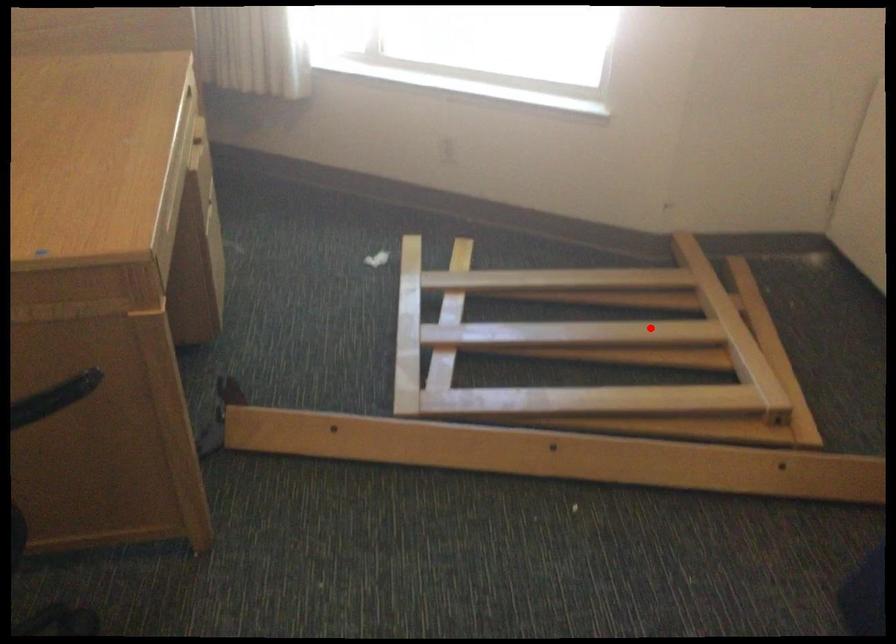
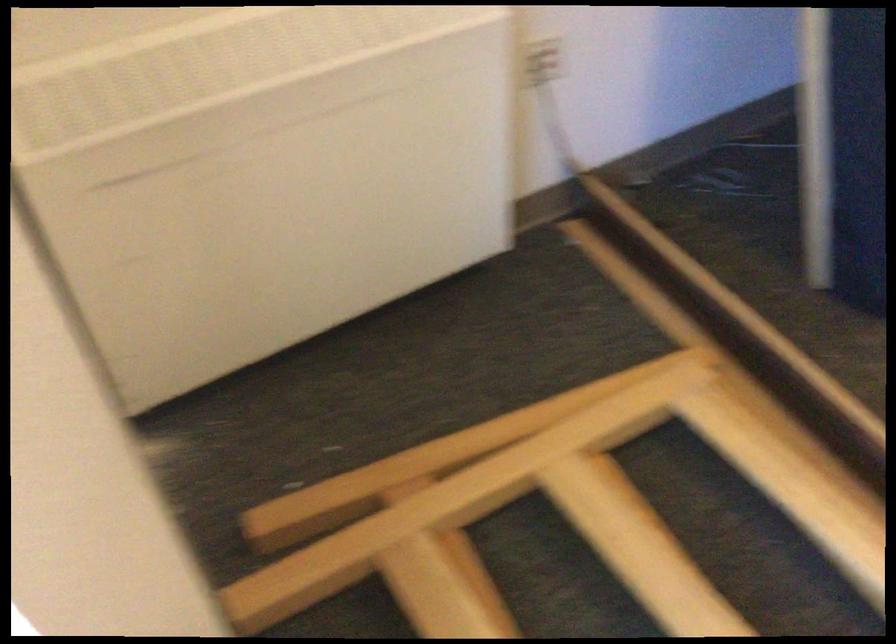
The point at the highlighted location is marked in the first image. Where is the corresponding point in the second image?

(632, 545)